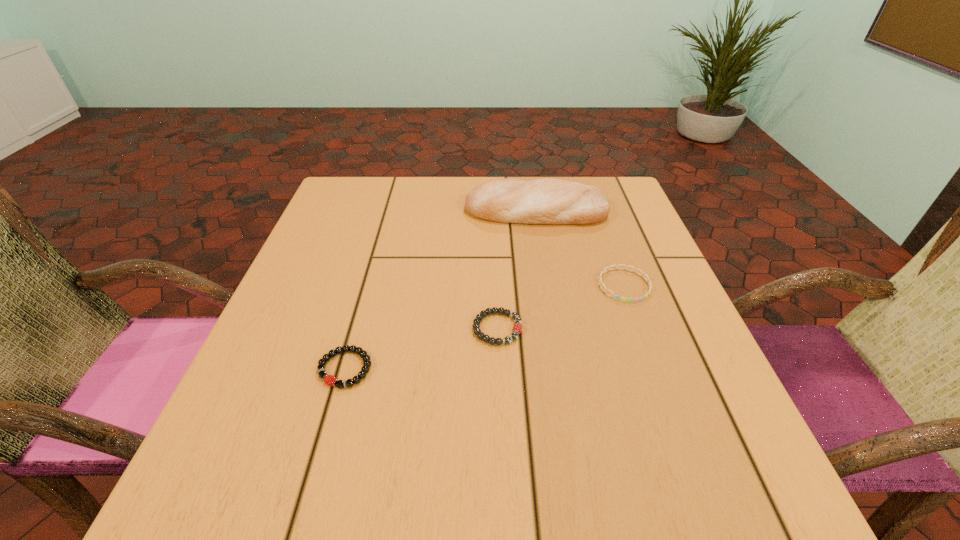
Where is `unoccupied position between the leftmost object and the farthest bracelet`? The width and height of the screenshot is (960, 540). unoccupied position between the leftmost object and the farthest bracelet is located at coordinates (485, 327).

This screenshot has width=960, height=540. Identify the location of vacant space that's between the second nearest bracelet and the nearest bracelet. (421, 349).

This screenshot has height=540, width=960. I want to click on free space that is in between the farthest object and the nearest bracelet, so click(x=441, y=290).

Find the location of a particular element. Image resolution: width=960 pixels, height=540 pixels. free space between the third farthest object and the leftmost bracelet is located at coordinates (421, 349).

You are a GUI agent. You are given a task and a screenshot of the screen. Output one action in this format:
    pyautogui.click(x=<x>, y=<y>)
    Task: Click on the vacant area that lies between the second nearest bracelet and the third nearest object
    
    Given the screenshot: What is the action you would take?
    pyautogui.click(x=561, y=307)

This screenshot has width=960, height=540. Find the location of `object that can be found as the second closest to the farthest object`. object that can be found as the second closest to the farthest object is located at coordinates (517, 328).

Select which object is the third closest to the second nearest bracelet. Please provide its 2D coordinates. Your answer should be formatted as a tuple, i.e. [(x, y)], where the tuple contains the x and y coordinates of a point satisfying the conditions above.

[(547, 201)]

Where is `bracelet that stands as the closest to the leftmost object`? The height and width of the screenshot is (540, 960). bracelet that stands as the closest to the leftmost object is located at coordinates (517, 328).

Locate an element on the screen. This screenshot has width=960, height=540. bracelet object that ranks as the closest to the farthest object is located at coordinates (600, 283).

This screenshot has width=960, height=540. In order to click on free space that satisfies the following two spatial constraints: 1. on the back side of the nearest bracelet; 2. on the right side of the bread in this screenshot , I will do tap(390, 211).